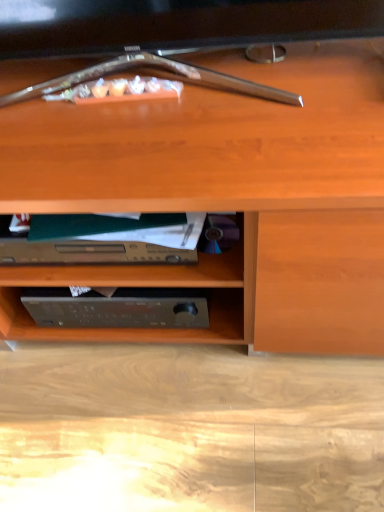
Where is `free space above metallic silver dvd player at lower center (from a real-world perspective)`? free space above metallic silver dvd player at lower center (from a real-world perspective) is located at coordinates (79, 226).